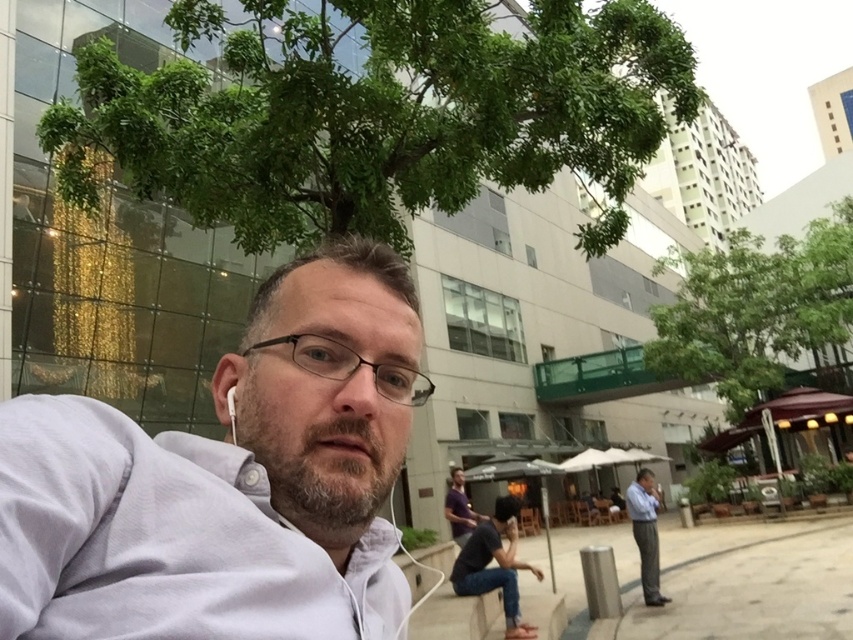
Can you confirm if black plastic glasses at center is taller than light blue shirt at right?

No, black plastic glasses at center is not taller than light blue shirt at right.

What do you see at coordinates (352, 365) in the screenshot? This screenshot has width=853, height=640. I see `black plastic glasses at center` at bounding box center [352, 365].

You are a GUI agent. You are given a task and a screenshot of the screen. Output one action in this format:
    pyautogui.click(x=<x>, y=<y>)
    Task: Click on the black plastic glasses at center
    This screenshot has height=640, width=853.
    Given the screenshot: What is the action you would take?
    pyautogui.click(x=352, y=365)

Does gray cotton shirt at center have a lesser width compared to green leafy tree at upper right?

Correct, gray cotton shirt at center's width is less than green leafy tree at upper right's.

In order to click on gray cotton shirt at center in this screenshot , I will do `click(228, 481)`.

Is green leafy tree at upper center closer to the viewer compared to gray cotton shirt at center?

That is False.

Is green leafy tree at upper center positioned behind gray cotton shirt at center?

Yes, it is.

Identify the location of green leafy tree at upper center. This screenshot has width=853, height=640. (376, 113).

Identify the location of green leafy tree at upper center. Image resolution: width=853 pixels, height=640 pixels. (376, 113).